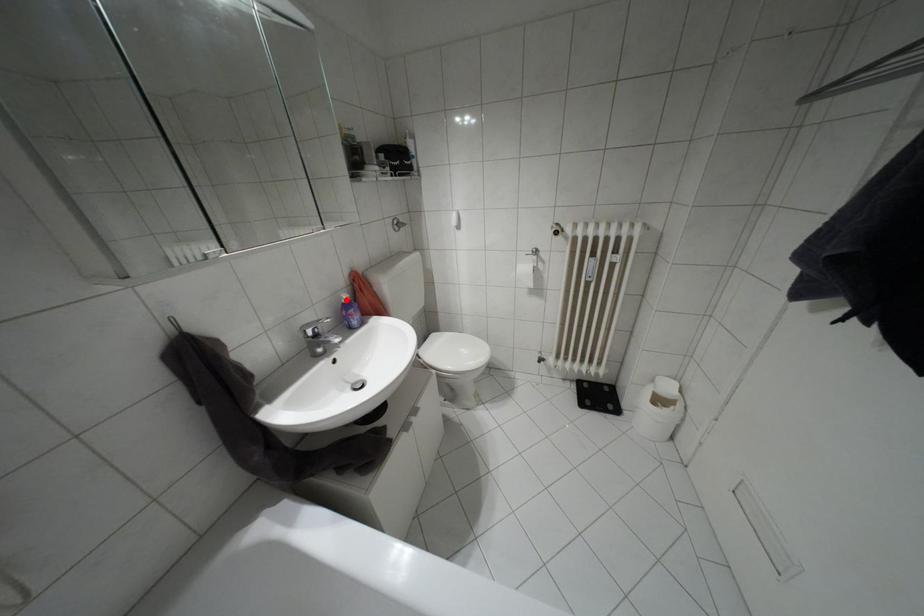
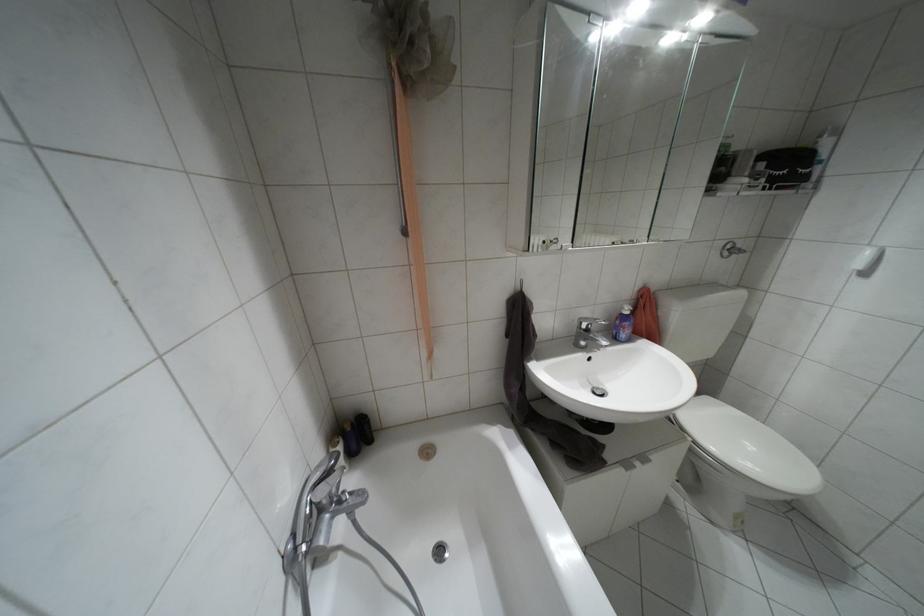
The point at the highlighted location is marked in the first image. Where is the corresponding point in the second image?

(626, 312)